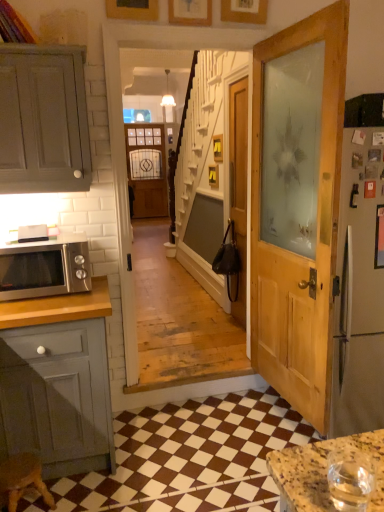
I want to click on vacant point to the left of wooden door at center, so click(x=210, y=328).